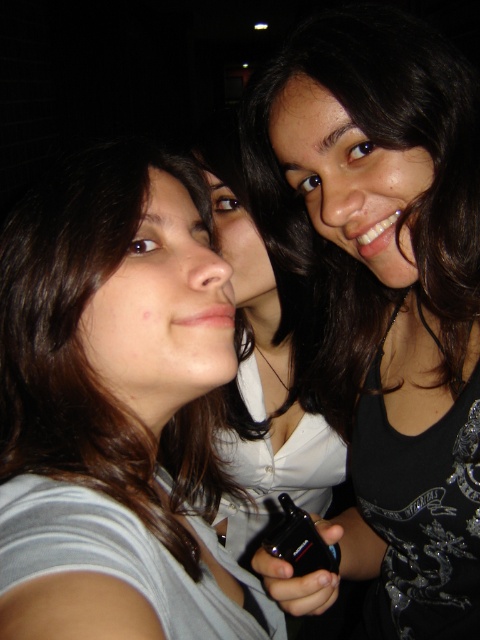
Question: Among these points, which one is farthest from the camera?

Choices:
 (A) (372, 60)
 (B) (322, 563)
 (C) (41, 410)

Answer: (B)

Question: Where is black glossy phone at center located in relation to black plastic phone at center in the image?

Choices:
 (A) below
 (B) above

Answer: (B)

Question: Which of the following is the farthest from the observer?

Choices:
 (A) (282, 493)
 (B) (73, 252)
 (C) (282, 588)

Answer: (A)

Question: Can you confirm if gray striped shirt at left is bigger than black plastic phone at center?

Choices:
 (A) yes
 (B) no

Answer: (A)

Question: Does black glossy phone at center appear on the right side of black plastic phone at center?

Choices:
 (A) no
 (B) yes

Answer: (B)

Question: Which of the following is the farthest from the observer?

Choices:
 (A) (147, 540)
 (B) (477, 493)
 (C) (287, 554)

Answer: (B)